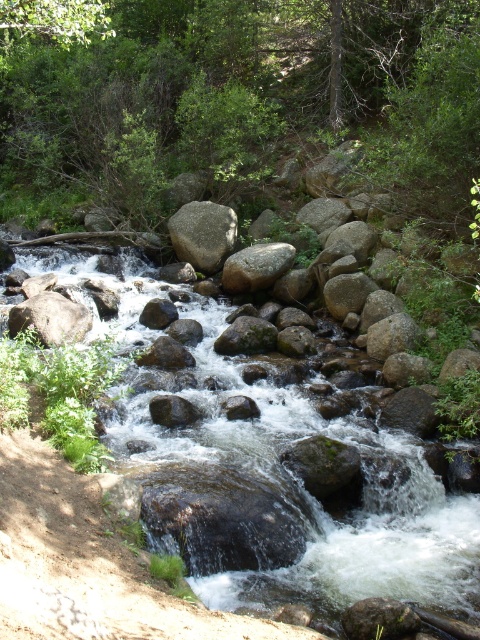
Question: Is smooth rock stream at center bigger than matte gray rock at center?

Choices:
 (A) no
 (B) yes

Answer: (A)

Question: Does smooth rock stream at center lie in front of gray rough rock at center?

Choices:
 (A) yes
 (B) no

Answer: (A)

Question: Which of the following is the closest to the observer?

Choices:
 (A) 193,225
 (B) 25,456
 (C) 155,413

Answer: (B)

Question: Which object appears farthest from the camera in this image?

Choices:
 (A) smooth rock stream at center
 (B) matte gray rock at center
 (C) smooth gray rock at center
 (D) gray rock at center

Answer: (D)

Question: Can you confirm if smooth rock stream at center is wider than gray rock at center?

Choices:
 (A) no
 (B) yes

Answer: (A)

Question: Estimate the real-world distances between objects in this image. Which object is closer to the gray rock at center?

Choices:
 (A) smooth rock stream at center
 (B) gray rough rock at center
 (C) smooth gray rock at center

Answer: (B)